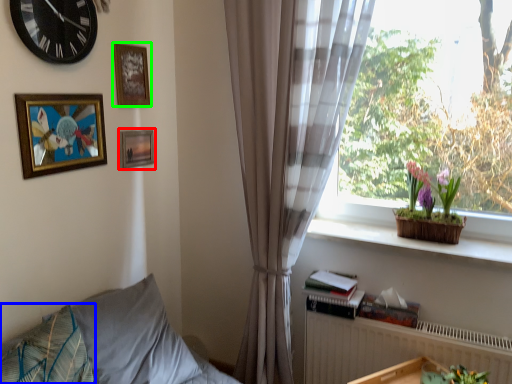
Question: Which object is the farthest from picture frame (highlighted by a red box)? Choose among these: pillow (highlighted by a blue box) or picture frame (highlighted by a green box).

Choices:
 (A) pillow
 (B) picture frame

Answer: (A)